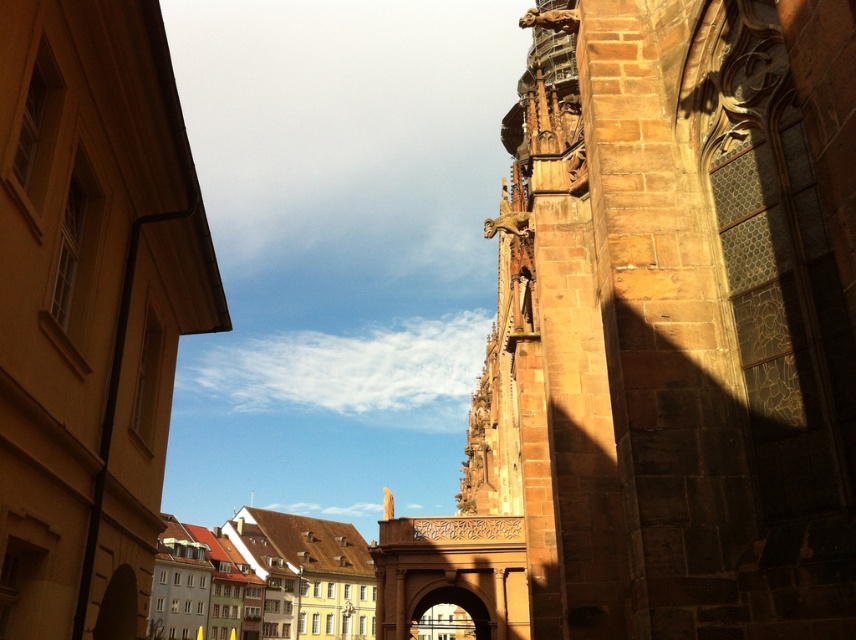
Which is above, brown stone church at upper left or light brown stone buildings at center?

brown stone church at upper left is higher up.

You are a GUI agent. You are given a task and a screenshot of the screen. Output one action in this format:
    pyautogui.click(x=<x>, y=<y>)
    Task: Click on the brown stone church at upper left
    Image resolution: width=856 pixels, height=640 pixels.
    Given the screenshot: What is the action you would take?
    pyautogui.click(x=90, y=307)

Which of these two, brown stone tower at upper right or brown stone church at upper left, stands taller?

brown stone tower at upper right

Which is more to the left, brown stone tower at upper right or brown stone church at upper left?

brown stone church at upper left is more to the left.

The image size is (856, 640). I want to click on brown stone tower at upper right, so click(661, 339).

The height and width of the screenshot is (640, 856). I want to click on brown stone tower at upper right, so click(661, 339).

Can you confirm if brown stone tower at upper right is positioned to the left of light brown stone buildings at center?

Incorrect, brown stone tower at upper right is not on the left side of light brown stone buildings at center.

Can you confirm if brown stone tower at upper right is taller than light brown stone buildings at center?

Correct, brown stone tower at upper right is much taller as light brown stone buildings at center.

Is point (829, 381) positioned after point (355, 618)?

No.

Find the location of a particular element. The width and height of the screenshot is (856, 640). brown stone tower at upper right is located at coordinates (661, 339).